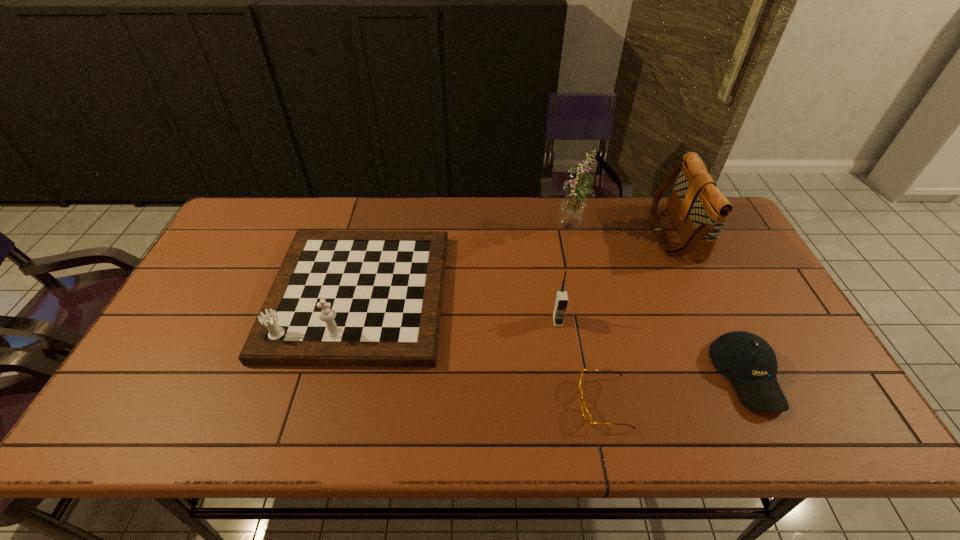
What are the coordinates of `vacant space at the far left corner of the desktop` in the screenshot? It's located at (284, 196).

Identify the location of vacant area that lies between the leftmost object and the baseball cap. The image size is (960, 540). (553, 334).

Identify the location of vacant space in between the second tallest object and the leftmost object. (516, 264).

Identify the location of free spot between the fifth shortest object and the leftmost object. The height and width of the screenshot is (540, 960). (516, 264).

At what (x,y) coordinates should I click in order to perform the action: click on free space between the tallest object and the shoulder bag. Please return your answer as a coordinate pair (x, y). The width and height of the screenshot is (960, 540). Looking at the image, I should click on (622, 232).

I want to click on free spot between the gameboard and the spectacles, so [481, 348].

Where is `vacant region between the shortest object and the fifth shortest object`? vacant region between the shortest object and the fifth shortest object is located at coordinates (639, 318).

Identify the location of free space that is in between the spectacles and the tallest object. (587, 316).

The height and width of the screenshot is (540, 960). I want to click on vacant area between the spectacles and the tallest object, so click(587, 316).

This screenshot has height=540, width=960. What are the coordinates of `vacant space that's between the gameboard and the second tallest object` in the screenshot? It's located at (516, 264).